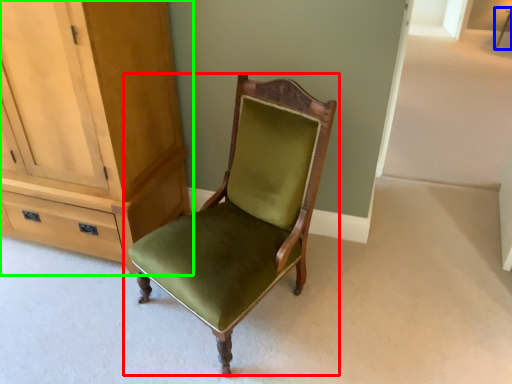
Question: Which object is the farthest from chair (highlighted by a red box)? Choose among these: side table (highlighted by a blue box) or cabinetry (highlighted by a green box).

Choices:
 (A) side table
 (B) cabinetry

Answer: (A)